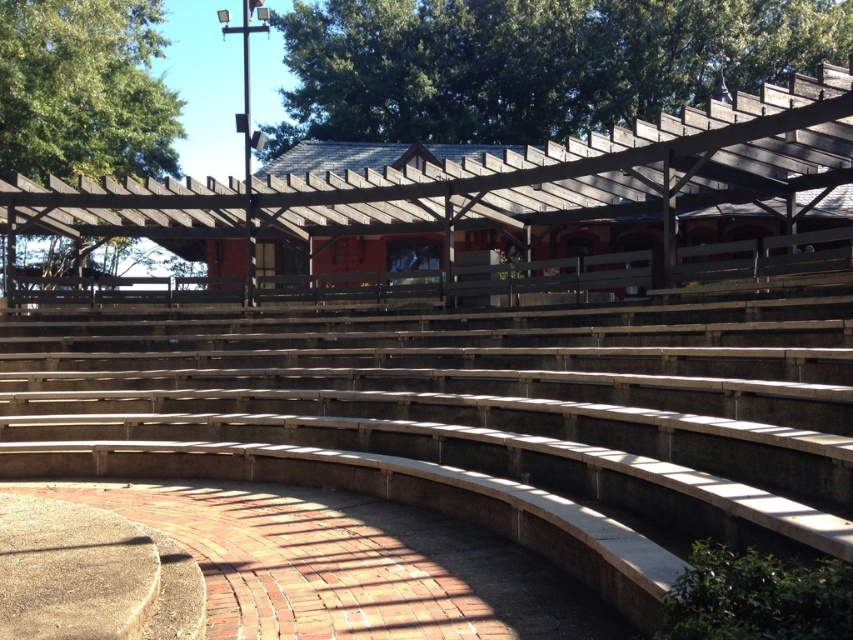
Which is more to the left, green leafy tree at upper center or green leafy tree at upper left?

From the viewer's perspective, green leafy tree at upper left appears more on the left side.

Is green leafy tree at upper center below green leafy tree at upper left?

Incorrect, green leafy tree at upper center is not positioned below green leafy tree at upper left.

Between point (556, 40) and point (22, 99), which one is positioned in front?

Positioned in front is point (22, 99).

Locate an element on the screen. green leafy tree at upper center is located at coordinates (532, 64).

Based on the photo, can you confirm if wooden bench at center is positioned to the left of green leafy tree at upper left?

In fact, wooden bench at center is to the right of green leafy tree at upper left.

Is wooden bench at center shorter than green leafy tree at upper left?

Yes.

Who is more distant from viewer, (80, 449) or (54, 138)?

The point (54, 138) is behind.

At what (x,y) coordinates should I click in order to perform the action: click on wooden bench at center. Please return your answer as a coordinate pair (x, y). Image resolution: width=853 pixels, height=640 pixels. Looking at the image, I should click on (477, 416).

Can you confirm if wooden bench at center is taller than green leafy tree at upper center?

In fact, wooden bench at center may be shorter than green leafy tree at upper center.

Does wooden bench at center come in front of green leafy tree at upper center?

Yes, it is.

Locate an element on the screen. The width and height of the screenshot is (853, 640). wooden bench at center is located at coordinates (477, 416).